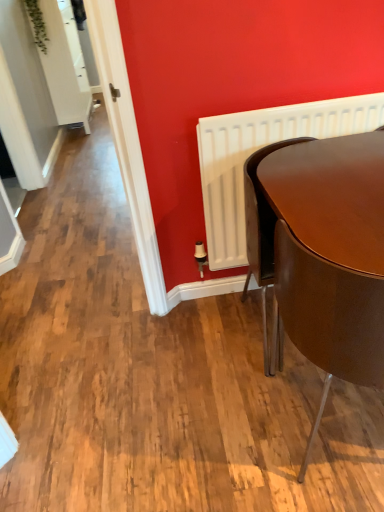
Question: Is white matte radiator at right closer to camera compared to glossy brown table at lower right?

Choices:
 (A) no
 (B) yes

Answer: (A)

Question: Considering the relative sizes of white matte radiator at right and glossy brown table at lower right in the image provided, is white matte radiator at right smaller than glossy brown table at lower right?

Choices:
 (A) yes
 (B) no

Answer: (A)

Question: Is there a large distance between white matte radiator at right and glossy brown table at lower right?

Choices:
 (A) no
 (B) yes

Answer: (A)

Question: Is white matte radiator at right further to the viewer compared to glossy brown table at lower right?

Choices:
 (A) yes
 (B) no

Answer: (A)

Question: Would you say white matte radiator at right is outside glossy brown table at lower right?

Choices:
 (A) no
 (B) yes

Answer: (B)

Question: Are white matte radiator at right and glossy brown table at lower right beside each other?

Choices:
 (A) yes
 (B) no

Answer: (B)

Question: Can white matte radiator at right be found inside glossy brown table at lower right?

Choices:
 (A) yes
 (B) no

Answer: (B)

Question: Is glossy brown table at lower right thinner than white matte radiator at right?

Choices:
 (A) no
 (B) yes

Answer: (A)

Question: Is white matte radiator at right at the back of glossy brown table at lower right?

Choices:
 (A) yes
 (B) no

Answer: (A)

Question: Is glossy brown table at lower right positioned beyond the bounds of white matte radiator at right?

Choices:
 (A) no
 (B) yes

Answer: (B)

Question: From the image's perspective, would you say glossy brown table at lower right is positioned over white matte radiator at right?

Choices:
 (A) no
 (B) yes

Answer: (A)

Question: Does glossy brown table at lower right come behind white matte radiator at right?

Choices:
 (A) yes
 (B) no

Answer: (B)

Question: Is matte brown chair at right far away from glossy brown table at lower right?

Choices:
 (A) no
 (B) yes

Answer: (A)